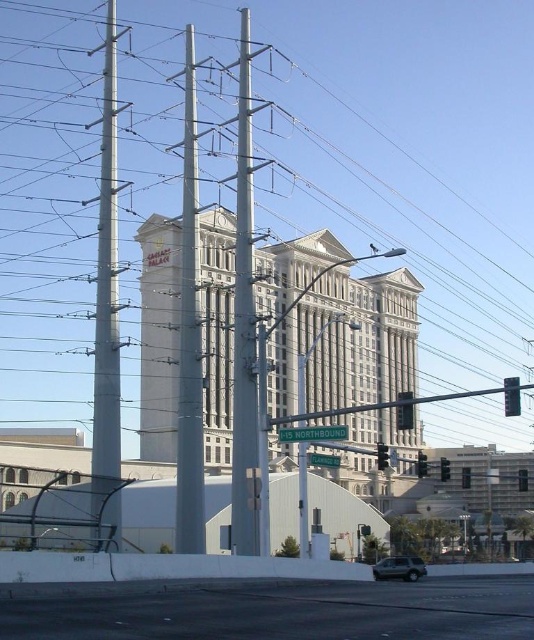
Does white metallic pole at left have a lesser height compared to metallic gray pole at center?

Yes.

Does white metallic pole at left appear on the right side of metallic gray pole at center?

Incorrect, white metallic pole at left is not on the right side of metallic gray pole at center.

Is point (109, 214) less distant than point (194, 484)?

Yes, it is in front of point (194, 484).

The image size is (534, 640). Identify the location of white metallic pole at left. (106, 317).

Is white metallic pole at center taller than black plastic traffic light at center right?

Indeed, white metallic pole at center has a greater height compared to black plastic traffic light at center right.

Can you confirm if white metallic pole at center is thinner than black plastic traffic light at center right?

No.

Who is more distant from viewer, [254,304] or [380,468]?

The point [380,468] is more distant.

Where is `white metallic pole at center`? This screenshot has width=534, height=640. white metallic pole at center is located at coordinates (245, 326).

Who is more distant from viewer, [105,138] or [422,467]?

Positioned behind is point [105,138].

Which is behind, point (111, 227) or point (421, 461)?

The point (111, 227) is behind.

Where is `white metallic pole at left`? This screenshot has width=534, height=640. white metallic pole at left is located at coordinates (106, 317).